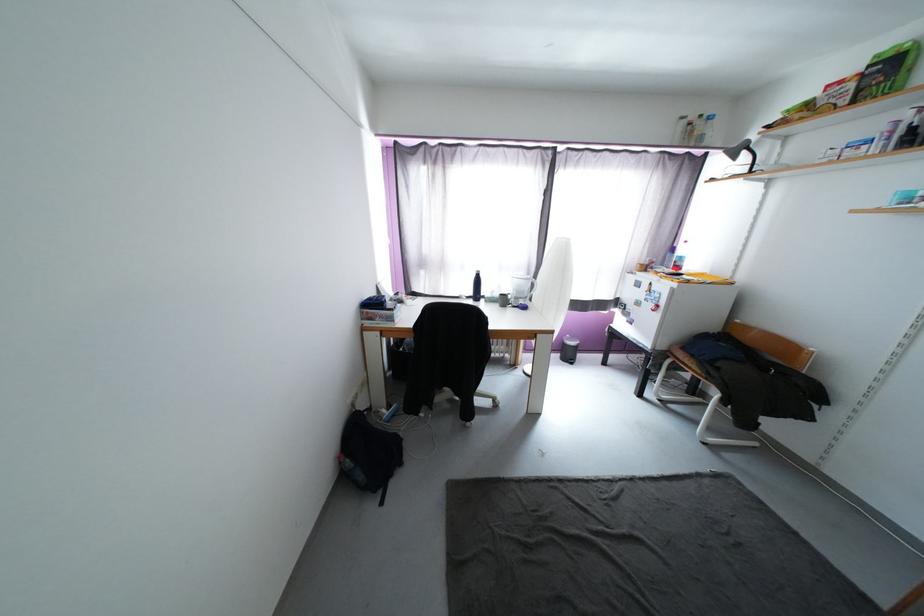
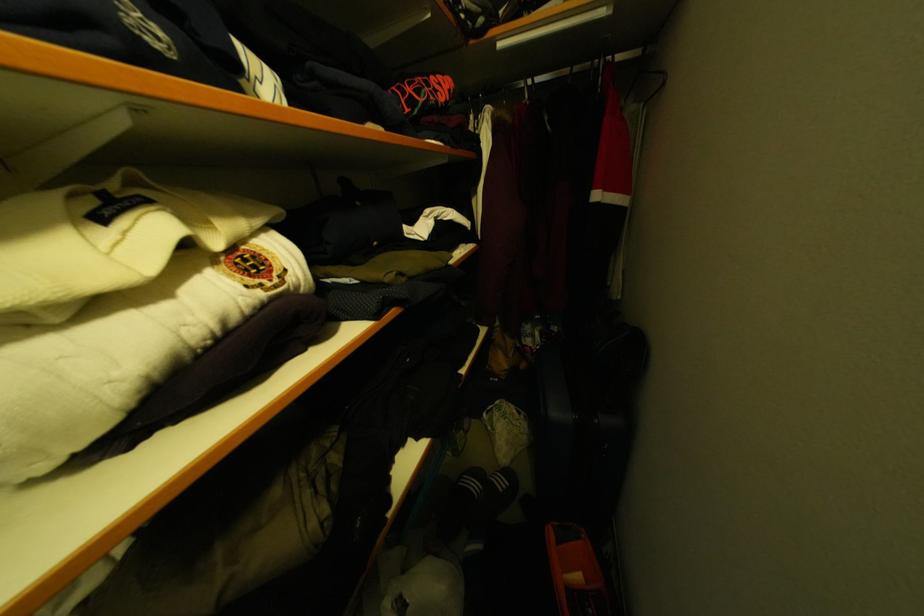
Question: I am providing you with two images of the same scene from different viewpoints. Please identify which objects are invisible in image2.

Choices:
 (A) beige shoe
 (B) dark suitcase
 (C) black desk lamp
 (D) black and white slide

Answer: (C)